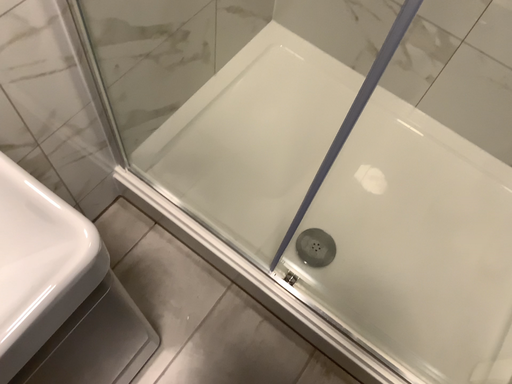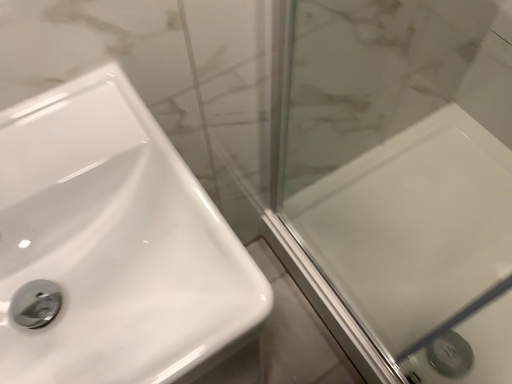
Question: How did the camera likely rotate when shooting the video?

Choices:
 (A) rotated upward
 (B) rotated downward

Answer: (A)